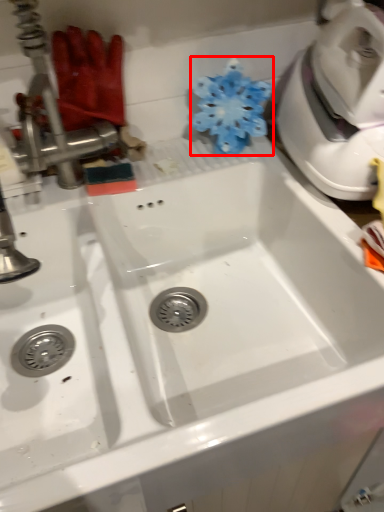
Question: Observing the image, what is the correct spatial positioning of flower (annotated by the red box) in reference to tap?

Choices:
 (A) left
 (B) right

Answer: (B)